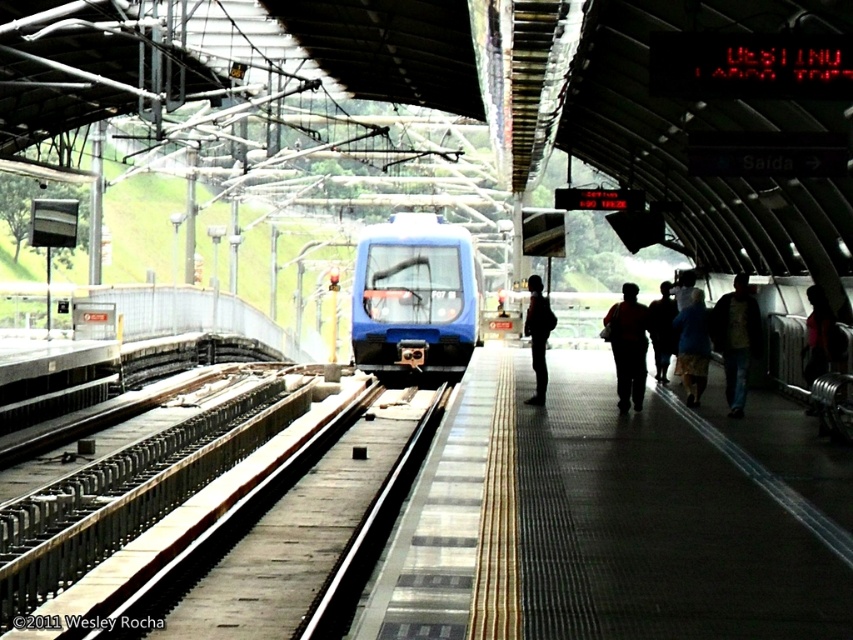
Question: Is matte orange shirt at center below blue fabric jacket at center?

Choices:
 (A) no
 (B) yes

Answer: (B)

Question: Is textured concrete platform at center positioned before matte orange shirt at center?

Choices:
 (A) yes
 (B) no

Answer: (A)

Question: Which point appears farthest from the camera in this image?

Choices:
 (A) tap(631, 296)
 (B) tap(746, 356)
 (C) tap(683, 378)

Answer: (C)

Question: Observing the image, what is the correct spatial positioning of blue glossy train at center in reference to dark blue backpack at center?

Choices:
 (A) left
 (B) right

Answer: (A)

Question: Estimate the real-world distances between objects in this image. Which object is closer to the blue fabric jacket at center?

Choices:
 (A) dark blue jeans at right
 (B) matte orange shirt at center

Answer: (A)

Question: Which object is farther from the camera taking this photo?

Choices:
 (A) blue glossy train at center
 (B) dark blue jeans at right
 (C) dark blue shirt at center
 (D) dark blue backpack at center

Answer: (A)